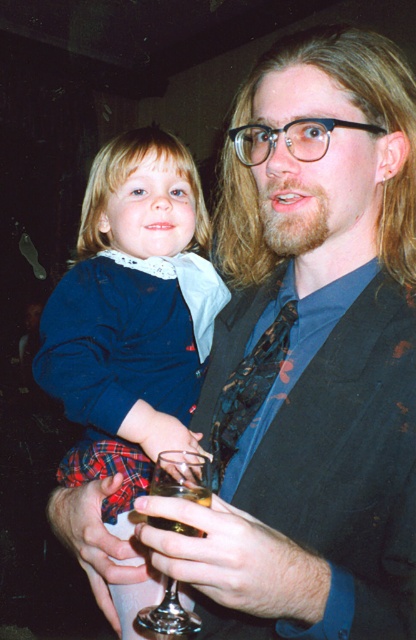
Between clear glass wine at center and translucent glass at center, which one is positioned lower?

Positioned lower is clear glass wine at center.

Is clear glass wine at center below translucent glass at center?

Correct, clear glass wine at center is located below translucent glass at center.

Where is `clear glass wine at center`? Image resolution: width=416 pixels, height=640 pixels. clear glass wine at center is located at coordinates (182, 476).

Can you confirm if matte blue dress at center is bigger than translucent glass at center?

Indeed, matte blue dress at center has a larger size compared to translucent glass at center.

Which is more to the left, matte blue dress at center or translucent glass at center?

Positioned to the left is matte blue dress at center.

Locate an element on the screen. matte blue dress at center is located at coordinates point(131,316).

Can you confirm if shiny black tie at center is thinner than clear glass wine at center?

In fact, shiny black tie at center might be wider than clear glass wine at center.

Who is lower down, shiny black tie at center or clear glass wine at center?

clear glass wine at center is below.

Identify the location of shiny black tie at center. Image resolution: width=416 pixels, height=640 pixels. (247, 390).